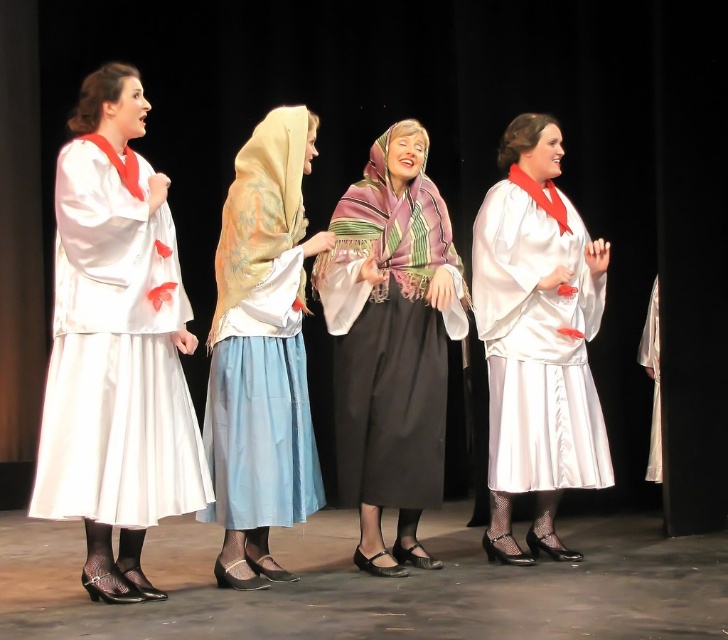
In the theatrical scene, you notice a matte white dress at left and a silky beige scarf at center. Which object is positioned to the right of the other?

The silky beige scarf at center is to the right of the matte white dress at left.